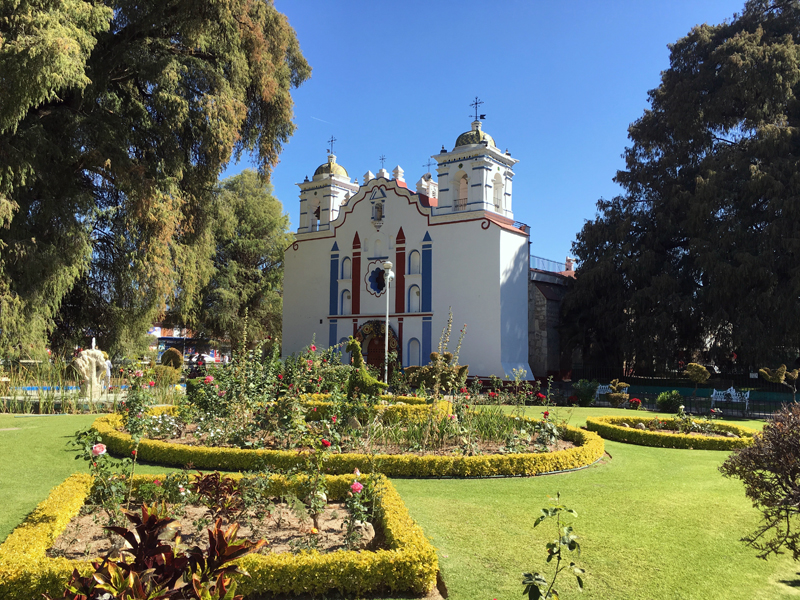
Locate an element on the screen. statue is located at coordinates (88, 355).